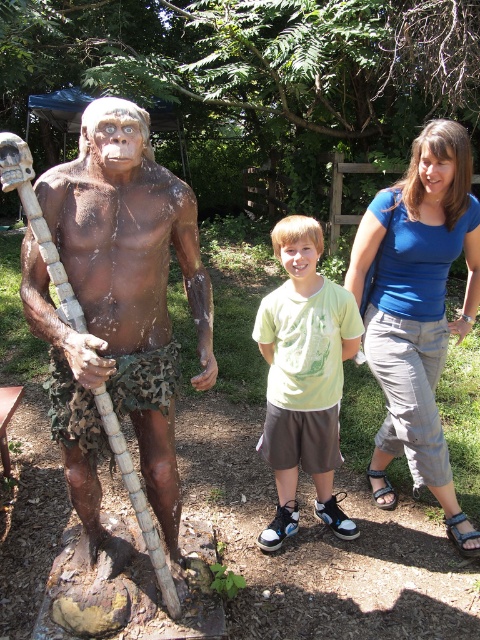
Between brown matte statue at left and blue cotton shirt at upper right, which one is positioned lower?

brown matte statue at left is lower down.

How far apart are brown matte statue at left and blue cotton shirt at upper right?

They are 3.68 feet apart.

Is point (167, 486) in front of point (471, 304)?

Yes, it is in front of point (471, 304).

Where is `brown matte statue at left`? The width and height of the screenshot is (480, 640). brown matte statue at left is located at coordinates (118, 307).

Who is more forward, (178, 243) or (283, 259)?

Positioned in front is point (178, 243).

Is the position of brown matte statue at left less distant than that of green cotton shirt at center?

Yes, brown matte statue at left is in front of green cotton shirt at center.

Is point (52, 388) less distant than point (320, 499)?

Yes, it is in front of point (320, 499).

Identify the location of brown matte statue at left. (118, 307).

Is point (384, 461) closer to camera compared to point (299, 356)?

No, (384, 461) is further to viewer.

Which is above, blue cotton shirt at upper right or green cotton shirt at center?

blue cotton shirt at upper right

Is point (388, 202) behind point (284, 384)?

Yes, it is behind point (284, 384).

You are a GUI agent. You are given a task and a screenshot of the screen. Output one action in this format:
    pyautogui.click(x=<x>, y=<y>)
    Task: Click on the blue cotton shirt at upper right
    The image size is (480, 640).
    Given the screenshot: What is the action you would take?
    pyautogui.click(x=419, y=308)